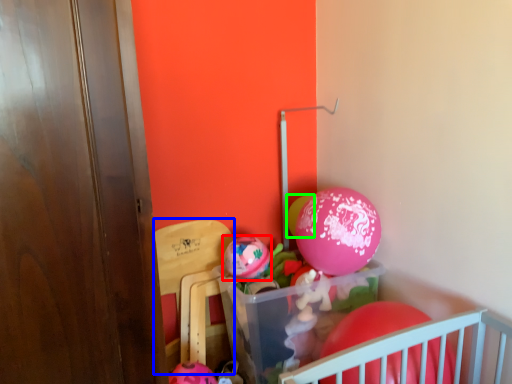
Question: Which object is the farthest from balloon (highlighted by a red box)? Choose among these: armchair (highlighted by a blue box) or balloon (highlighted by a green box).

Choices:
 (A) armchair
 (B) balloon

Answer: (B)